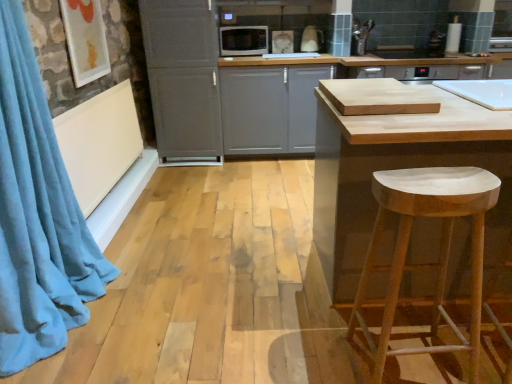
Identify the location of vacant space underneath white matte stool at lower right (from a real-world perspective). (406, 362).